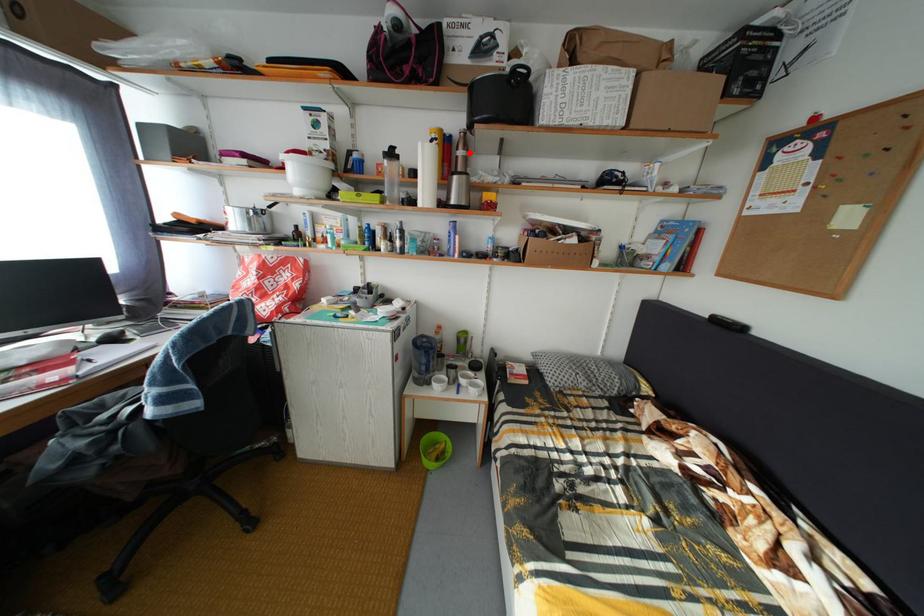
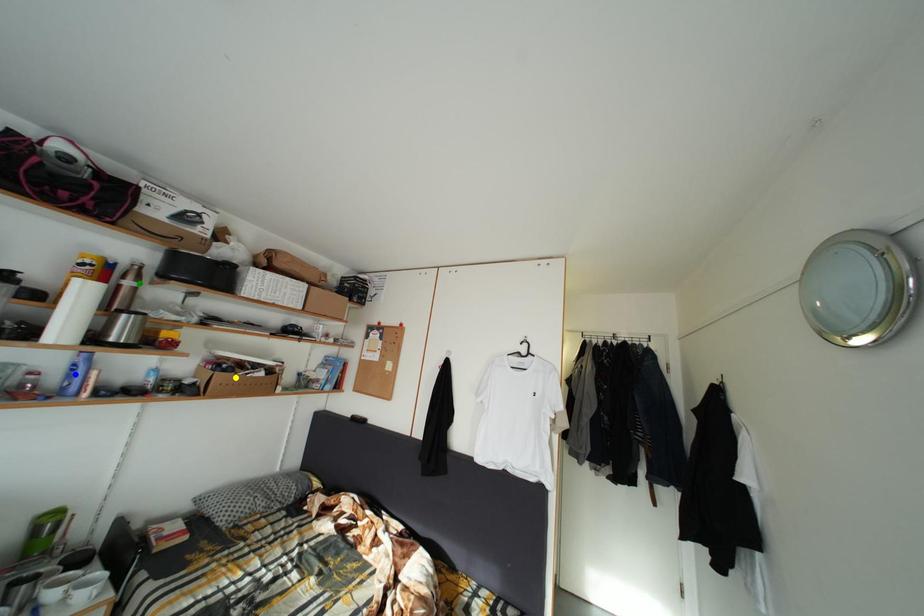
Question: I am providing you with two images of the same scene from different viewpoints. A red point is marked on the first image. You are given multiple points on the second image. Which spot in image 2 lines up with the point in image 1?

Choices:
 (A) yellow point
 (B) green point
 (C) blue point

Answer: (B)